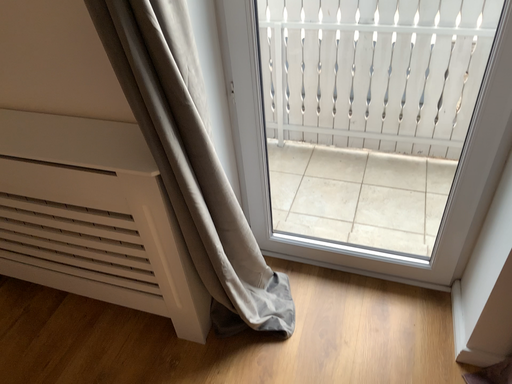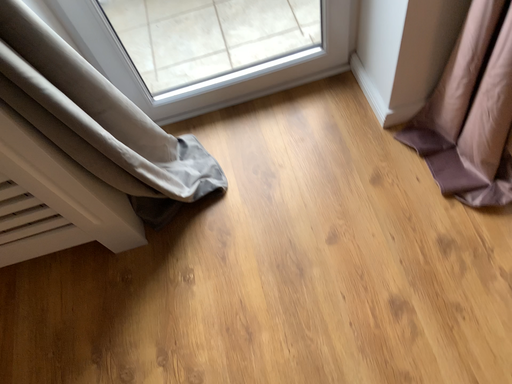
Question: How did the camera likely rotate when shooting the video?

Choices:
 (A) rotated downward
 (B) rotated upward

Answer: (A)